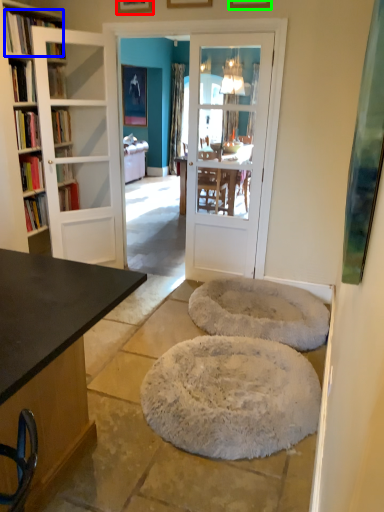
Question: Estimate the real-world distances between objects in this image. Which object is closer to picture frame (highlighted by a red box), book (highlighted by a blue box) or picture frame (highlighted by a green box)?

Choices:
 (A) book
 (B) picture frame

Answer: (A)